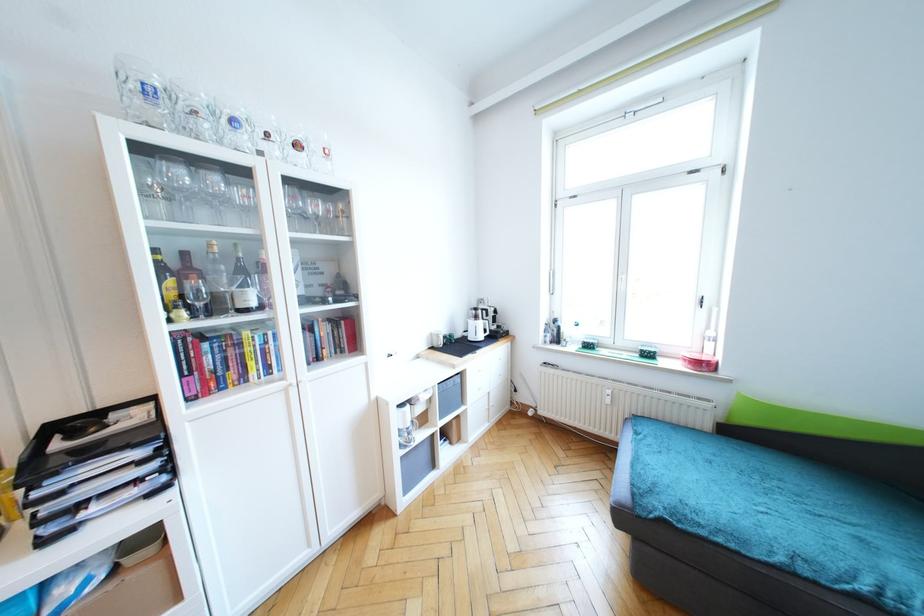
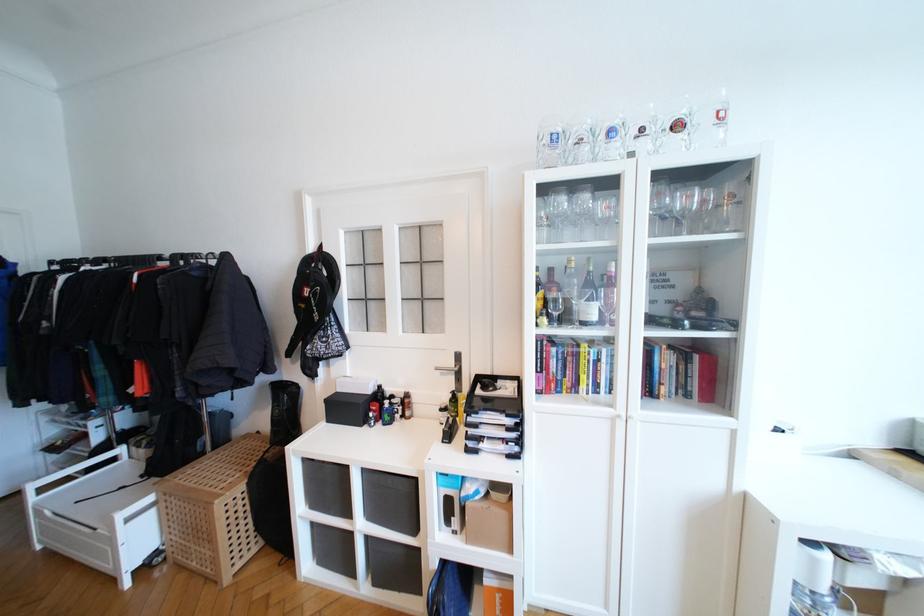
Locate, in the second image, the point that corresponds to (x=241, y=260) in the first image.

(591, 273)